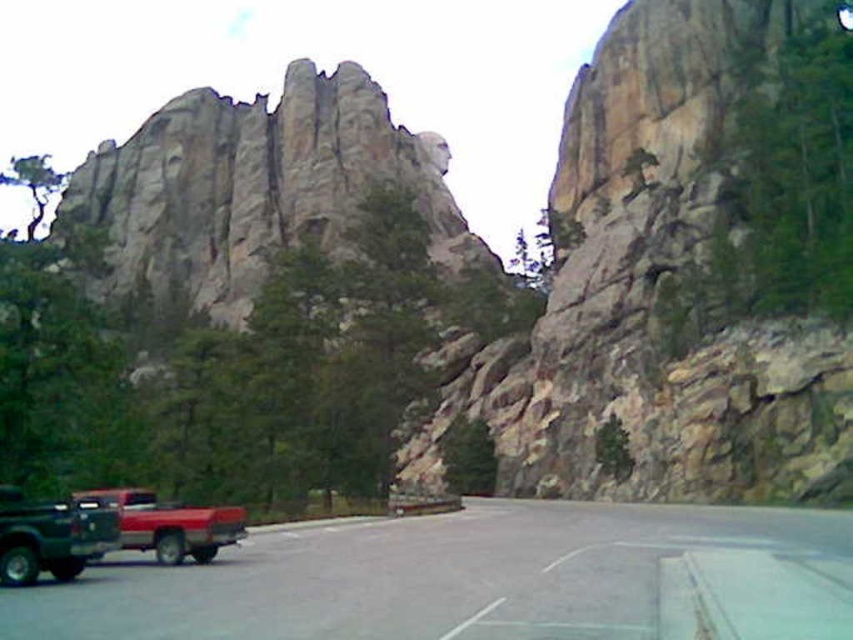
Question: Among these points, which one is farthest from the camera?

Choices:
 (A) (409, 618)
 (B) (88, 554)
 (C) (169, 544)

Answer: (C)

Question: Which object is positioned closest to the gray asphalt highway at center?

Choices:
 (A) brushed metal truck at lower left
 (B) matte red truck at lower left

Answer: (B)

Question: Observing the image, what is the correct spatial positioning of gray asphalt highway at center in reference to matte red truck at lower left?

Choices:
 (A) right
 (B) left

Answer: (A)

Question: Is brushed metal truck at lower left above matte red truck at lower left?

Choices:
 (A) yes
 (B) no

Answer: (A)

Question: Which point is farther to the camera?

Choices:
 (A) gray asphalt highway at center
 (B) matte red truck at lower left
 (C) brushed metal truck at lower left

Answer: (B)

Question: Is brushed metal truck at lower left further to camera compared to matte red truck at lower left?

Choices:
 (A) yes
 (B) no

Answer: (B)